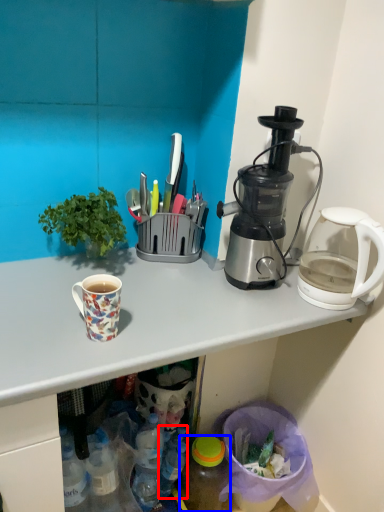
Question: Among these objects, which one is nearest to the camera, bottle (highlighted by a red box) or bottle (highlighted by a blue box)?

Choices:
 (A) bottle
 (B) bottle

Answer: (B)